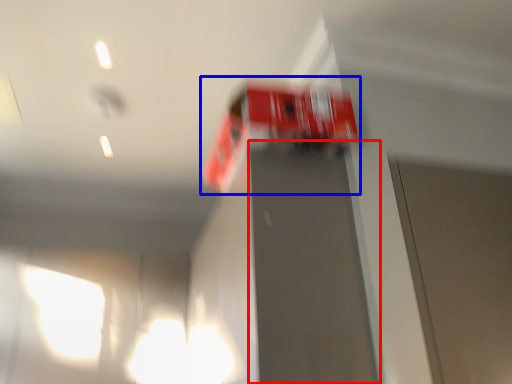
Question: Among these objects, which one is farthest to the camera, elevator door (highlighted by a red box) or vehicle (highlighted by a blue box)?

Choices:
 (A) elevator door
 (B) vehicle

Answer: (B)